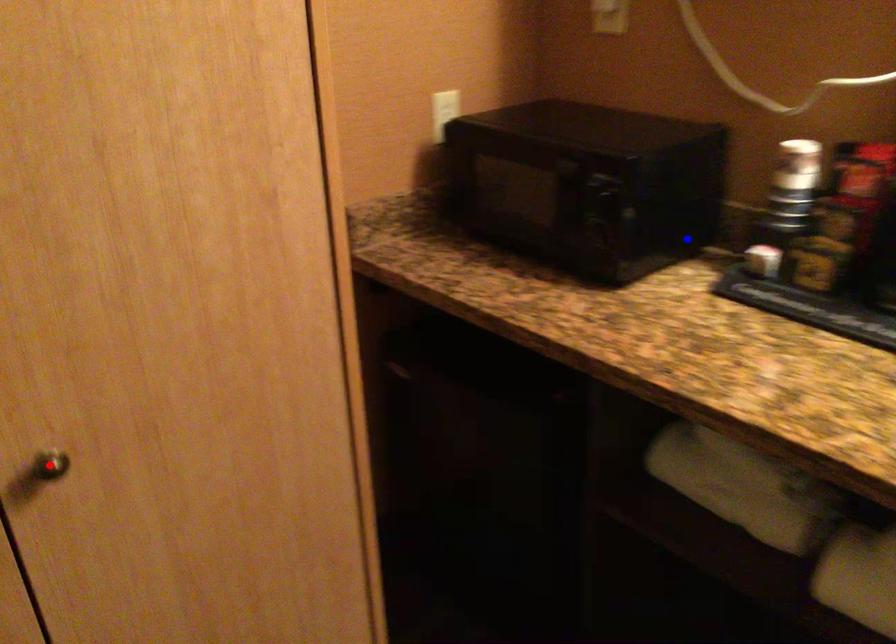
Question: Which of the two points in the image is closer to the camera?

Choices:
 (A) Blue point is closer.
 (B) Red point is closer.

Answer: (B)